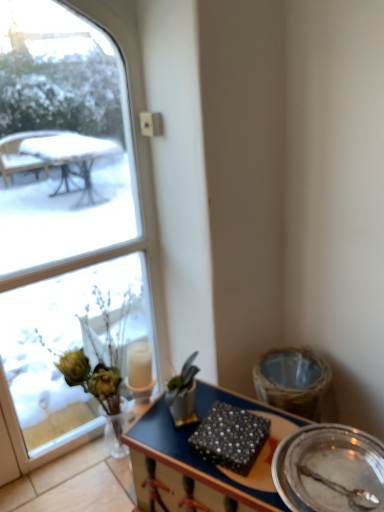
Question: From a real-world perspective, is metallic silver plate at lower right positioned over pearl-patterned fabric at center based on gravity?

Choices:
 (A) yes
 (B) no

Answer: (B)

Question: Is metallic silver plate at lower right wider than pearl-patterned fabric at center?

Choices:
 (A) yes
 (B) no

Answer: (A)

Question: Considering the relative positions of metallic silver plate at lower right and pearl-patterned fabric at center in the image provided, is metallic silver plate at lower right to the right of pearl-patterned fabric at center from the viewer's perspective?

Choices:
 (A) yes
 (B) no

Answer: (A)

Question: From the image's perspective, is metallic silver plate at lower right over pearl-patterned fabric at center?

Choices:
 (A) no
 (B) yes

Answer: (A)

Question: Is metallic silver plate at lower right closer to the viewer compared to pearl-patterned fabric at center?

Choices:
 (A) no
 (B) yes

Answer: (B)

Question: Is point (99, 396) positioned closer to the camera than point (228, 437)?

Choices:
 (A) closer
 (B) farther

Answer: (B)

Question: From a real-world perspective, is translucent glass vase at left physically located above or below pearl-patterned fabric at center?

Choices:
 (A) below
 (B) above

Answer: (A)

Question: Choose the correct answer: Is translucent glass vase at left inside pearl-patterned fabric at center or outside it?

Choices:
 (A) outside
 (B) inside

Answer: (A)

Question: From the image's perspective, is translucent glass vase at left positioned above or below pearl-patterned fabric at center?

Choices:
 (A) below
 (B) above

Answer: (B)

Question: Would you say clear glass window at upper left is to the left or to the right of wooden desk at center in the picture?

Choices:
 (A) right
 (B) left

Answer: (B)

Question: In terms of height, does clear glass window at upper left look taller or shorter compared to wooden desk at center?

Choices:
 (A) short
 (B) tall

Answer: (B)

Question: Looking at their shapes, would you say clear glass window at upper left is wider or thinner than wooden desk at center?

Choices:
 (A) wide
 (B) thin

Answer: (B)

Question: From the image's perspective, is clear glass window at upper left above or below wooden desk at center?

Choices:
 (A) below
 (B) above

Answer: (B)

Question: From a real-world perspective, is pearl-patterned fabric at center physically located above or below translucent glass vase at left?

Choices:
 (A) below
 (B) above

Answer: (B)

Question: Is pearl-patterned fabric at center taller or shorter than translucent glass vase at left?

Choices:
 (A) short
 (B) tall

Answer: (A)